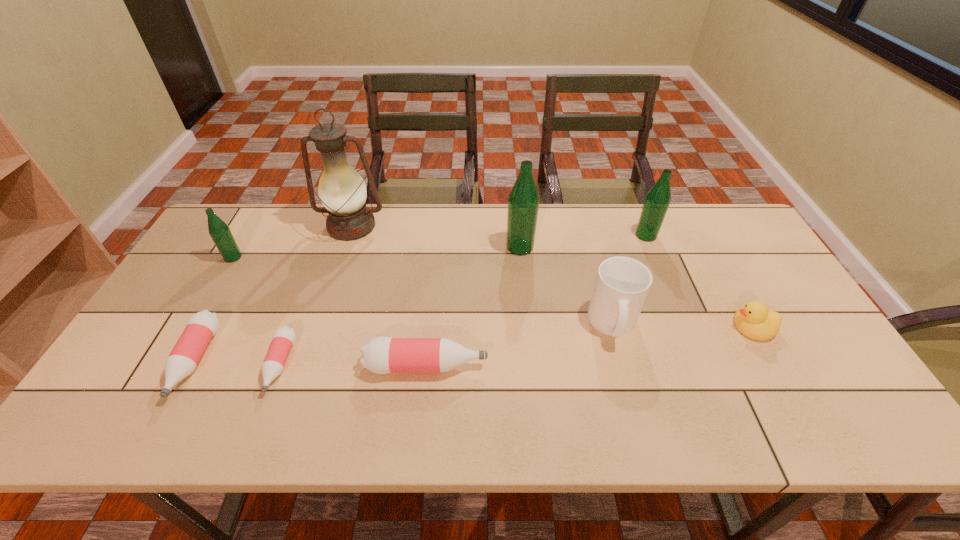
Where is `blank region between the shortest object and the rightmost object`? This screenshot has height=540, width=960. blank region between the shortest object and the rightmost object is located at coordinates (516, 346).

You are a GUI agent. You are given a task and a screenshot of the screen. Output one action in this format:
    pyautogui.click(x=<x>, y=<y>)
    Task: Click on the empty location between the third bottle from right to left and the seventh object from left to right
    
    Given the screenshot: What is the action you would take?
    pyautogui.click(x=519, y=345)

Identify the location of vacant area between the second object from right to left and the fourth shortest bottle. (440, 246).

The width and height of the screenshot is (960, 540). Find the location of `free space between the oil lamp and the second biggest green bottle`. free space between the oil lamp and the second biggest green bottle is located at coordinates (499, 231).

Find the location of a particular element. The height and width of the screenshot is (540, 960). empty space between the rightmost green bottle and the third bottle from left to right is located at coordinates (463, 300).

Locate an element on the screen. Image resolution: width=960 pixels, height=540 pixels. the seventh closest object relative to the second shortest bottle is located at coordinates (658, 198).

Identify which object is the third nearest to the smallest pink bottle. Please provide its 2D coordinates. Your answer should be formatted as a tuple, i.e. [(x, y)], where the tuple contains the x and y coordinates of a point satisfying the conditions above.

[(219, 231)]

This screenshot has height=540, width=960. I want to click on bottle that is the third closest to the leftmost green bottle, so click(381, 355).

Identify which bottle is located as the nearest to the fifth object from left to right. Please provide its 2D coordinates. Your answer should be formatted as a tuple, i.e. [(x, y)], where the tuple contains the x and y coordinates of a point satisfying the conditions above.

[(283, 338)]

Identify which green bottle is located as the second nearest to the rightmost pink bottle. Please provide its 2D coordinates. Your answer should be formatted as a tuple, i.e. [(x, y)], where the tuple contains the x and y coordinates of a point satisfying the conditions above.

[(219, 231)]